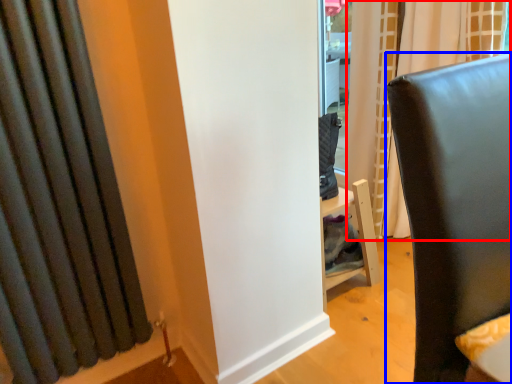
Question: Which object appears closest to the camera in this image, curtain (highlighted by a red box) or furniture (highlighted by a blue box)?

Choices:
 (A) curtain
 (B) furniture

Answer: (B)